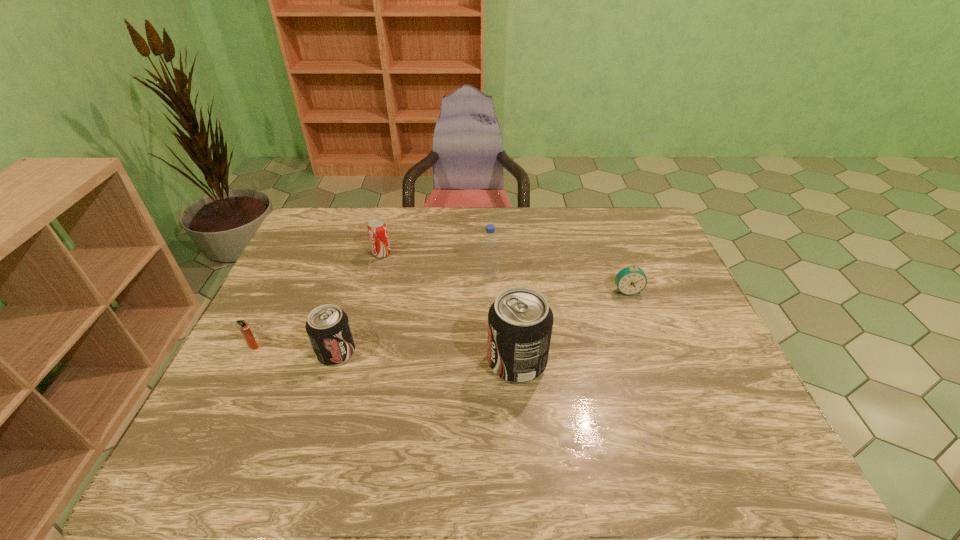
Find the location of a particular element. Image resolution: width=960 pixels, height=540 pixels. free space between the second farthest object and the farthest soda can is located at coordinates (436, 265).

The width and height of the screenshot is (960, 540). I want to click on free spot between the third farthest object and the second farthest object, so click(x=559, y=284).

Identify the location of free space between the rightmost soda can and the farthest soda can. This screenshot has height=540, width=960. (449, 308).

What are the coordinates of `free space between the alarm clock and the farthest object` in the screenshot? It's located at (504, 272).

Where is `vacant area that lies between the igniter and the farthest object`? Image resolution: width=960 pixels, height=540 pixels. vacant area that lies between the igniter and the farthest object is located at coordinates (318, 300).

Identify the location of object that is the closest to the fourth nearest object. (520, 321).

The width and height of the screenshot is (960, 540). What are the coordinates of `object that stands as the fourth closest to the second farthest object` in the screenshot? It's located at (328, 328).

Identify the location of soda can object that ranks as the closest to the tallest soda can. The image size is (960, 540). (328, 328).

Locate which soda can ranks third in proximity to the igniter. Please provide its 2D coordinates. Your answer should be formatted as a tuple, i.e. [(x, y)], where the tuple contains the x and y coordinates of a point satisfying the conditions above.

[(520, 321)]

The image size is (960, 540). I want to click on vacant space that satisfies the following two spatial constraints: 1. on the logo side of the fifth nearest object; 2. on the right side of the farthest object, so click(x=375, y=277).